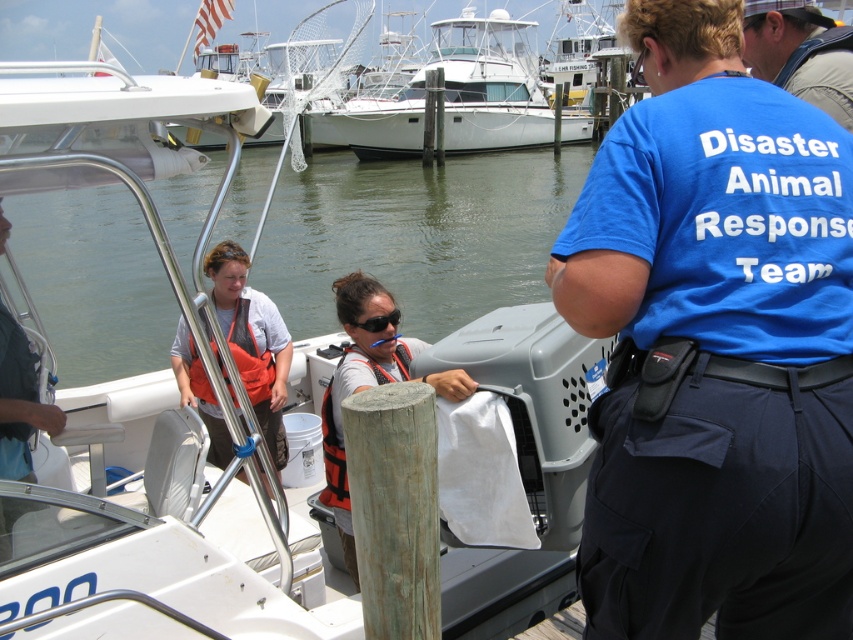
Is white glossy boat at upper center bigger than orange life vest at center?

Yes, white glossy boat at upper center is bigger than orange life vest at center.

Who is taller, white glossy boat at upper center or orange life vest at center?

white glossy boat at upper center is taller.

Is point (387, 134) closer to viewer compared to point (360, 284)?

No.

In order to click on white glossy boat at upper center in this screenshot , I will do `click(460, 93)`.

The image size is (853, 640). What do you see at coordinates (395, 508) in the screenshot?
I see `green wood pole at center` at bounding box center [395, 508].

I want to click on green wood pole at center, so click(395, 508).

Does point (399, 616) lie behind point (793, 1)?

That is False.

The width and height of the screenshot is (853, 640). I want to click on green wood pole at center, so click(395, 508).

Is blue cotton shirt at center below orange life jacket at center?

No.

Image resolution: width=853 pixels, height=640 pixels. Describe the element at coordinates (714, 346) in the screenshot. I see `blue cotton shirt at center` at that location.

Where is `blue cotton shirt at center`? The width and height of the screenshot is (853, 640). blue cotton shirt at center is located at coordinates (714, 346).